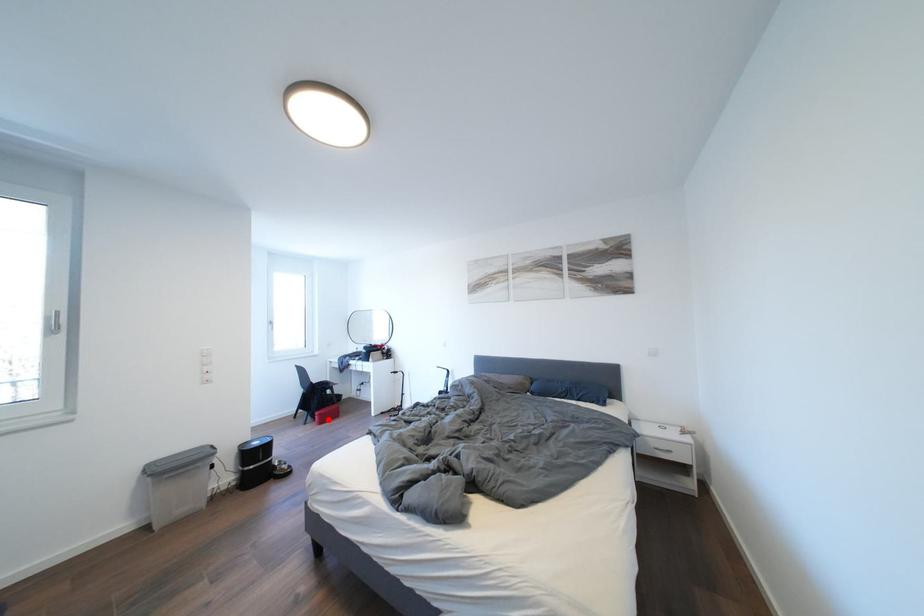
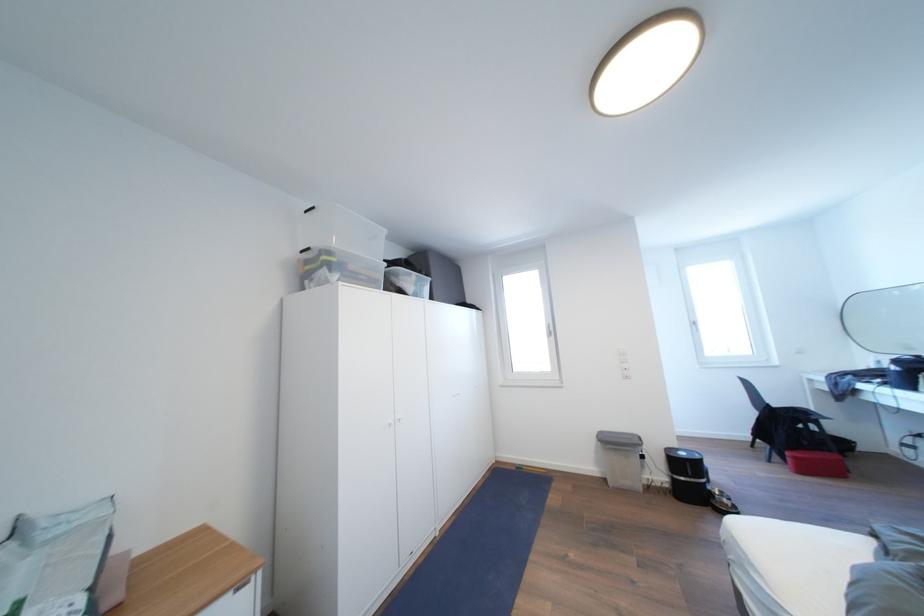
Question: I am providing you with two images of the same scene from different viewpoints. A red point is shown in image1. For the corresponding object point in image2, is it positioned nearer or farther from the camera?

Choices:
 (A) Nearer
 (B) Farther

Answer: (B)